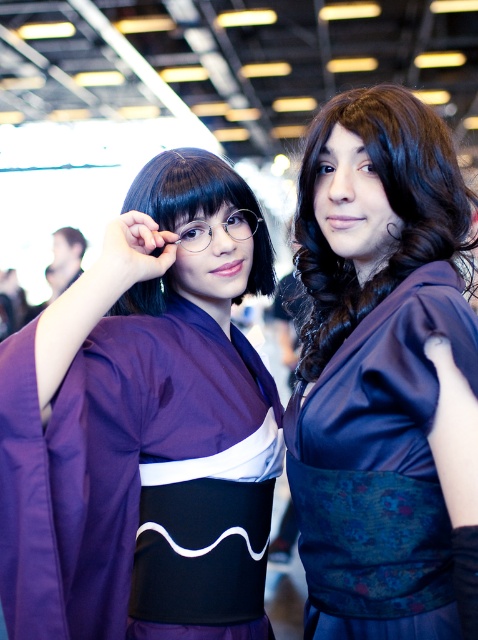
You are a photographer at the event and want to capture a clear photo of both the satin purple kimono at center and the matte black glasses at center. Since the kimono is under the glasses, will the glasses block the view of the kimono in the photo?

The satin purple kimono at center is positioned under matte black glasses at center, so the glasses will block part of the kimono in the photo.

You are a photographer at a cosplay event and need to capture a clear photo of both the matte purple kimono at left and the satin purple kimono at center. The minimum distance required between the two subjects for your camera to focus properly is 10 inches. Will you be able to achieve proper focus with their current positioning?

The matte purple kimono at left and the satin purple kimono at center are only 9.57 inches apart, which is less than the required 10 inches. Therefore, the camera may struggle to focus properly on both subjects simultaneously.

What is the significance of the point at coordinates (145, 428) in the image?

The point at coordinates (145, 428) indicates the location of the matte purple kimono at left.